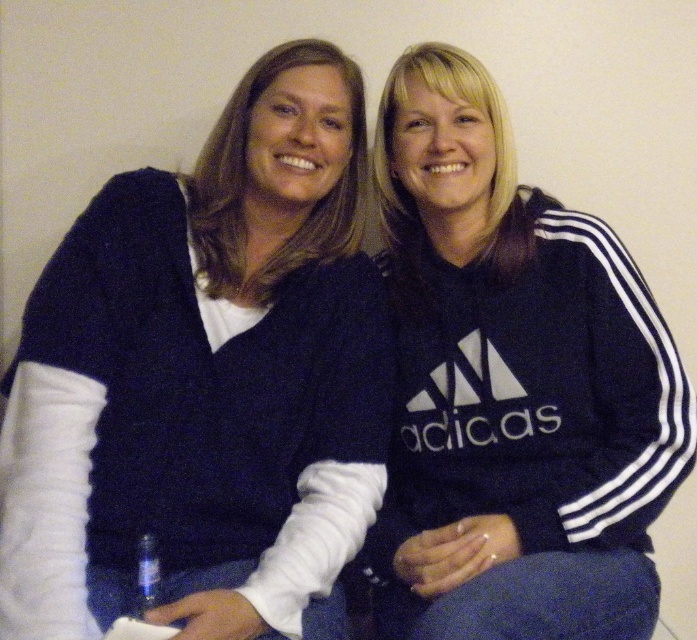
You are a photographer setting up for a group photo. You need to ensure that the knitted dark blue sweater at left and the navy blue hoodie at center are both in focus. The camera you are using has a depth of field that can cover objects within a 10 inch range. Can both items be in focus at the same time?

The knitted dark blue sweater at left is 9.48 inches away from the navy blue hoodie at center, which is within the 10 inch range of the camera. Therefore, both items can be in focus simultaneously.

You are designing a display for a clothing store and need to arrange the knitted dark blue sweater at left and navy blue hoodie at center based on their sizes. Which item should be placed on the smaller display shelf and which on the larger one?

The knitted dark blue sweater at left is smaller than the navy blue hoodie at center, so the sweater should be placed on the smaller display shelf and the hoodie on the larger one.

You are standing in front of a photo of two people sitting against a wall. You notice the knitted dark blue sweater at left and the navy blue hoodie at center. Which clothing item is positioned more to the left?

The knitted dark blue sweater at left is positioned more to the left than the navy blue hoodie at center.